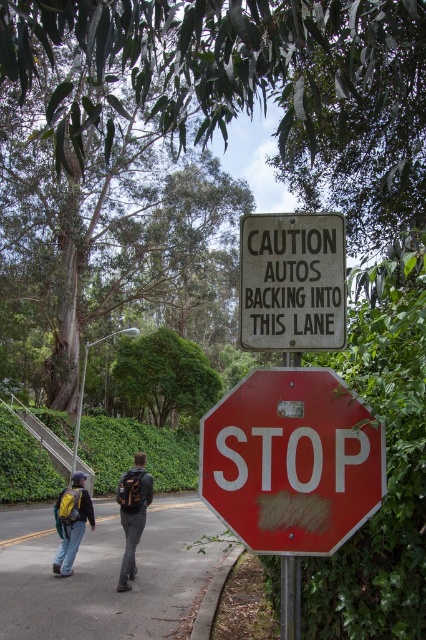
You are a pedestrian trying to read both the smooth red stop sign at center and the white paper sign at center. Which one do you think is taller?

The smooth red stop sign at center is taller than the white paper sign at center.

You are a pedestrian standing at the edge of the road and see the green leafy hedge at lower center and the yellow backpack at left. Which object is closer to you?

The yellow backpack at left is behind the green leafy hedge at lower center, so the green leafy hedge at lower center is closer to you.

You are a delivery robot with a 1.5 meter wide package. You need to navigate from the yellow backpack at left to the green leafy hedge at lower center. Is there enough space for you to pass through the area between them?

The distance between the green leafy hedge at lower center and the yellow backpack at left is 21.41 meters. Since the robot with a 1.5 meter wide package requires less space, there is sufficient room for it to pass through the area between them.